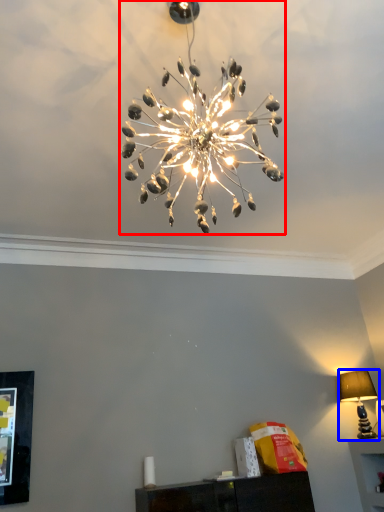
Question: Which of the following is the farthest to the observer, lamp (highlighted by a red box) or lamp (highlighted by a blue box)?

Choices:
 (A) lamp
 (B) lamp

Answer: (B)